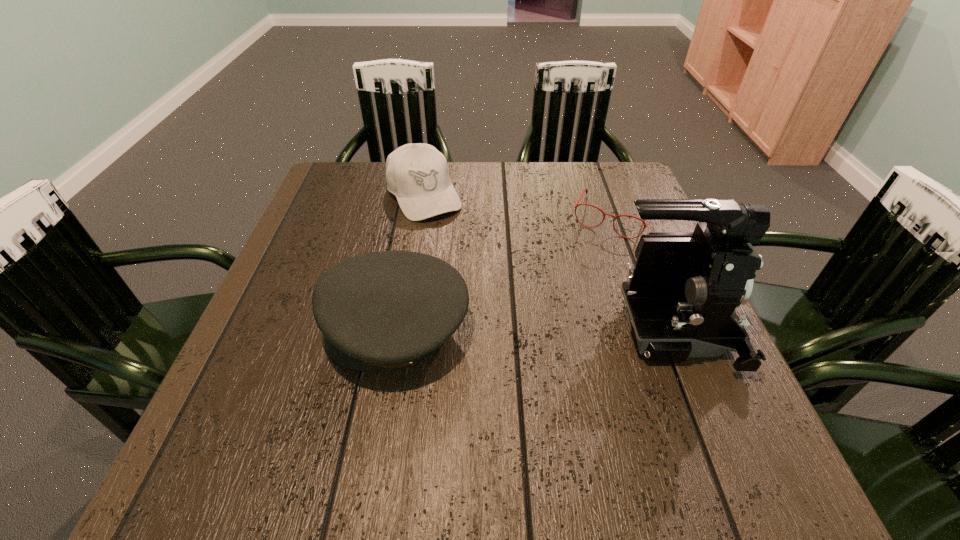
Where is `free space on the desktop that is between the beret and the tallest object and is positioned on the face of the shortest object`? This screenshot has width=960, height=540. free space on the desktop that is between the beret and the tallest object and is positioned on the face of the shortest object is located at coordinates (559, 332).

Find the location of a particular element. free space on the desktop that is between the beret and the tallest object and is positioned on the front-facing side of the baseball cap is located at coordinates (514, 331).